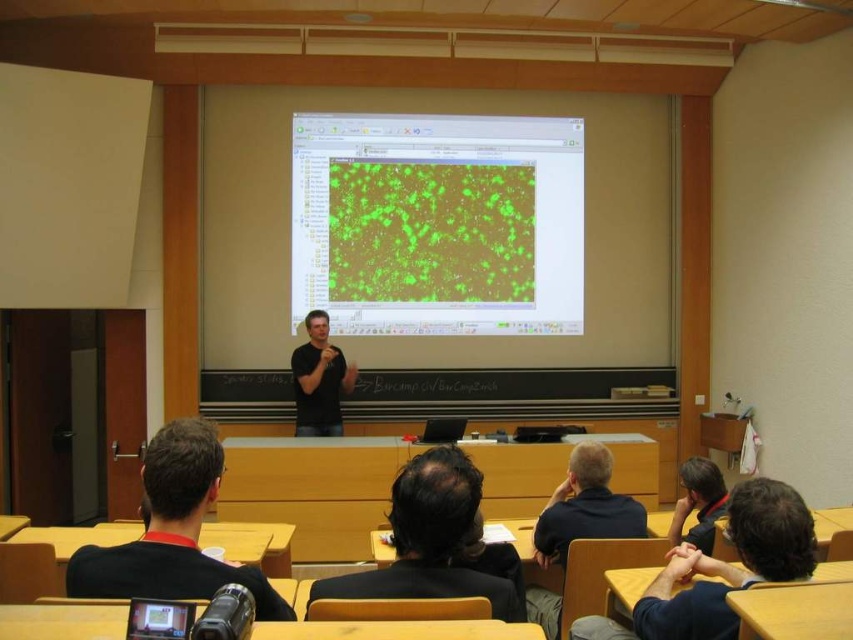
Question: Among these objects, which one is nearest to the camera?

Choices:
 (A) black fabric shirt at lower left
 (B) black matte shirt at center
 (C) dark blue shirt at lower right

Answer: (A)

Question: Which point is closer to the camera?

Choices:
 (A) green matte image at center
 (B) black matte shirt at center
 (C) black fabric shirt at lower left

Answer: (C)

Question: Considering the relative positions of black fabric shirt at lower left and dark blue shirt at lower right in the image provided, where is black fabric shirt at lower left located with respect to dark blue shirt at lower right?

Choices:
 (A) right
 (B) left

Answer: (B)

Question: Is dark blue shirt at lower right bigger than black matte shirt at center?

Choices:
 (A) yes
 (B) no

Answer: (B)

Question: Which point is closer to the camera taking this photo?

Choices:
 (A) [x=323, y=378]
 (B) [x=469, y=152]
 (C) [x=428, y=564]

Answer: (C)

Question: Does dark brown hair at center appear on the left side of black matte shirt at center?

Choices:
 (A) yes
 (B) no

Answer: (B)